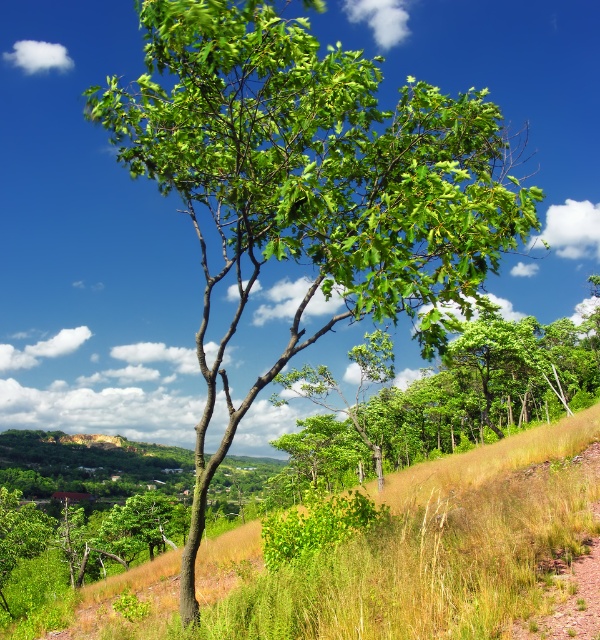
Between point (206, 632) and point (529, 355), which one is positioned behind?

Point (529, 355)

Does grassy hillside at center appear over green leafy tree at center?

Indeed, grassy hillside at center is positioned over green leafy tree at center.

This screenshot has width=600, height=640. What do you see at coordinates (421, 548) in the screenshot?
I see `grassy hillside at center` at bounding box center [421, 548].

Locate an element on the screen. grassy hillside at center is located at coordinates (421, 548).